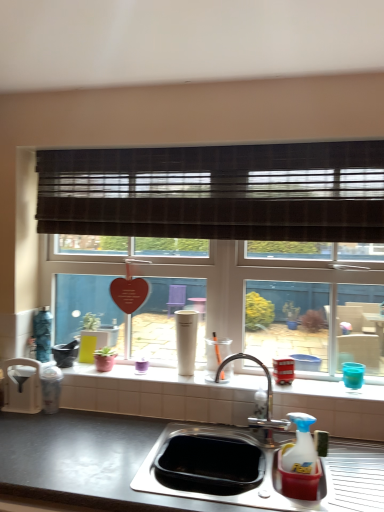
Image resolution: width=384 pixels, height=512 pixels. I want to click on vacant area that is in front of metallic red bus at right, positioned as the fourth appliance in left-to-right order, so click(298, 387).